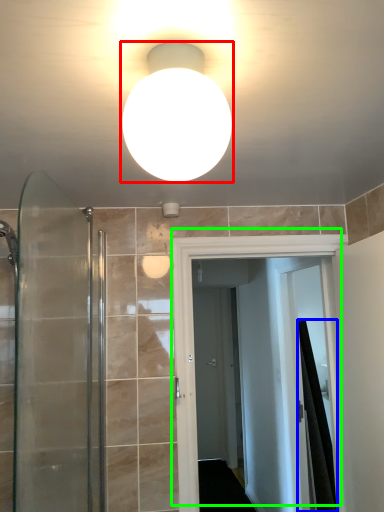
Question: Estimate the real-world distances between objects in this image. Which object is farther from light fixture (highlighted by a red box), shower curtain (highlighted by a blue box) or door (highlighted by a green box)?

Choices:
 (A) shower curtain
 (B) door

Answer: (A)